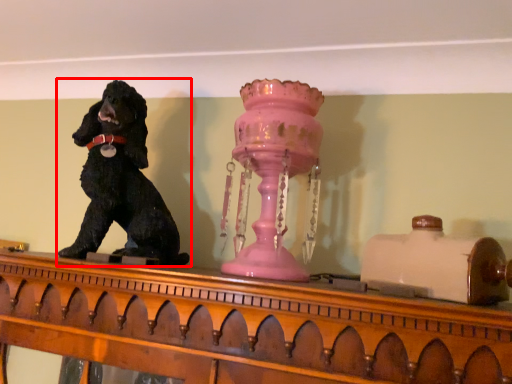
Question: Where is dog (annotated by the red box) located in relation to candle holder in the image?

Choices:
 (A) right
 (B) left

Answer: (B)